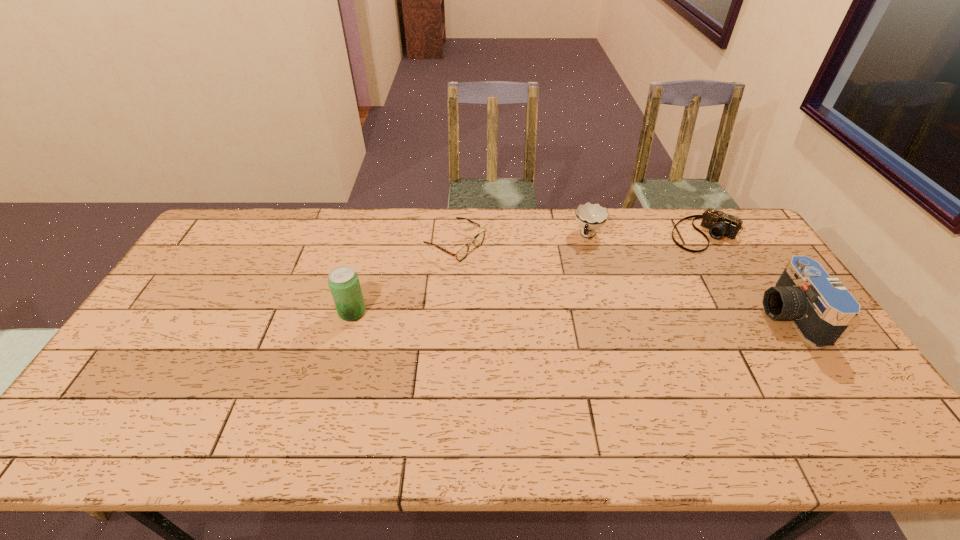
Locate an element on the screen. The image size is (960, 540). vacant space at the near right corner is located at coordinates (826, 395).

The height and width of the screenshot is (540, 960). Identify the location of empty location between the spectacles and the third tallest object. (522, 240).

You are a GUI agent. You are given a task and a screenshot of the screen. Output one action in this format:
    pyautogui.click(x=<x>, y=<y>)
    Task: Click on the vacant space that is in between the shorter camera and the cup
    
    Given the screenshot: What is the action you would take?
    pyautogui.click(x=646, y=234)

Locate an element on the screen. The height and width of the screenshot is (540, 960). free spot between the farther camera and the nearer camera is located at coordinates (747, 274).

At what (x,y) coordinates should I click in order to perform the action: click on free space between the second object from left to right and the leftmost object. Please return your answer as a coordinate pair (x, y). The width and height of the screenshot is (960, 540). Looking at the image, I should click on (404, 278).

At what (x,y) coordinates should I click in order to perform the action: click on empty space between the fourth object from right to left and the shorter camera. Please return your answer as a coordinate pair (x, y). This screenshot has width=960, height=540. Looking at the image, I should click on (580, 239).

Image resolution: width=960 pixels, height=540 pixels. Find the location of `free space between the farther camera and the taller camera`. free space between the farther camera and the taller camera is located at coordinates (747, 274).

Where is `free space between the third tallest object and the taller camera`? The width and height of the screenshot is (960, 540). free space between the third tallest object and the taller camera is located at coordinates (688, 275).

Find the location of a particular element. The width and height of the screenshot is (960, 540). empty space between the cup and the nearer camera is located at coordinates (688, 275).

I want to click on vacant space that is in between the shortest object and the nearer camera, so click(x=622, y=280).